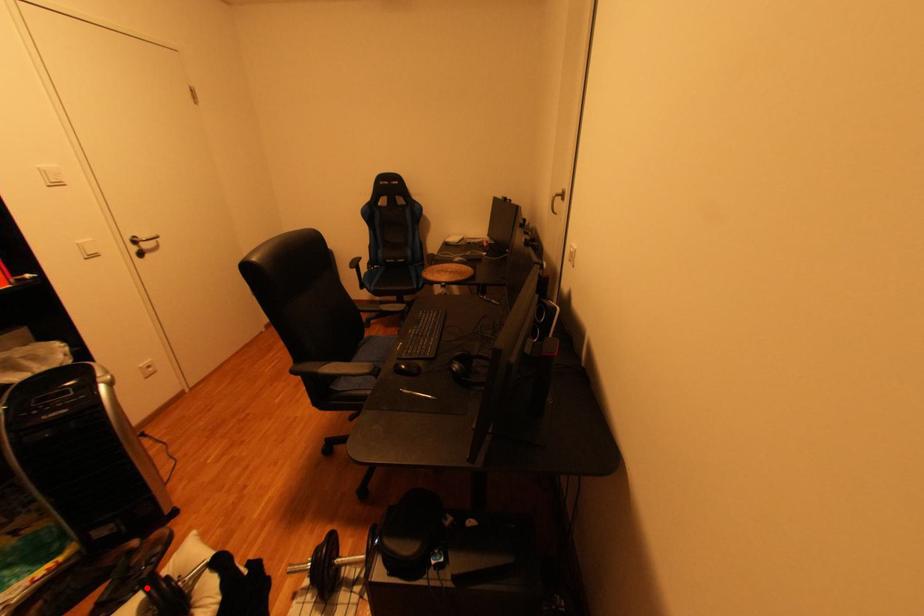
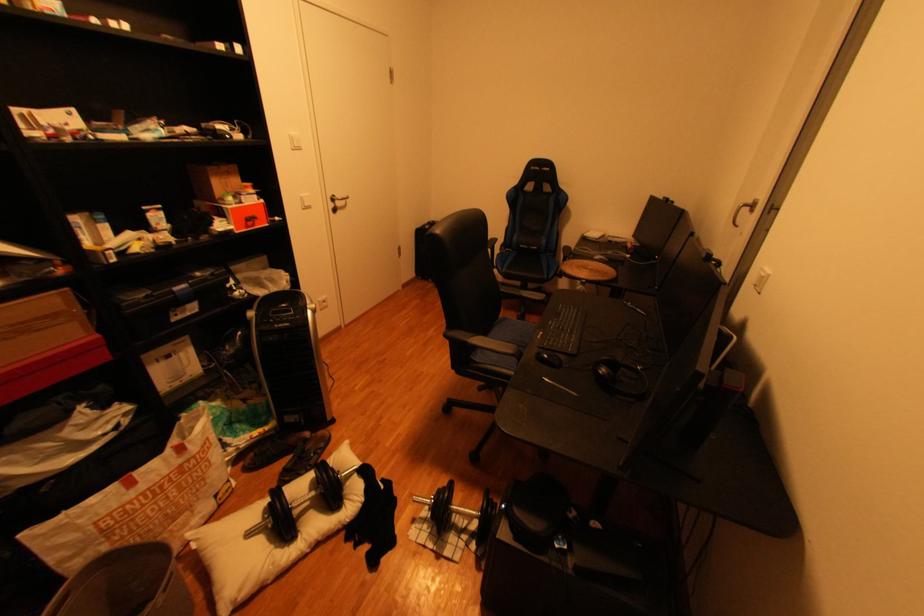
Question: A red point is marked in image1. In image2, is the corresponding 3D point closer to the camera or farther? Reply with the corresponding letter.

Choices:
 (A) The corresponding 3D point is closer.
 (B) The corresponding 3D point is farther.

Answer: (A)